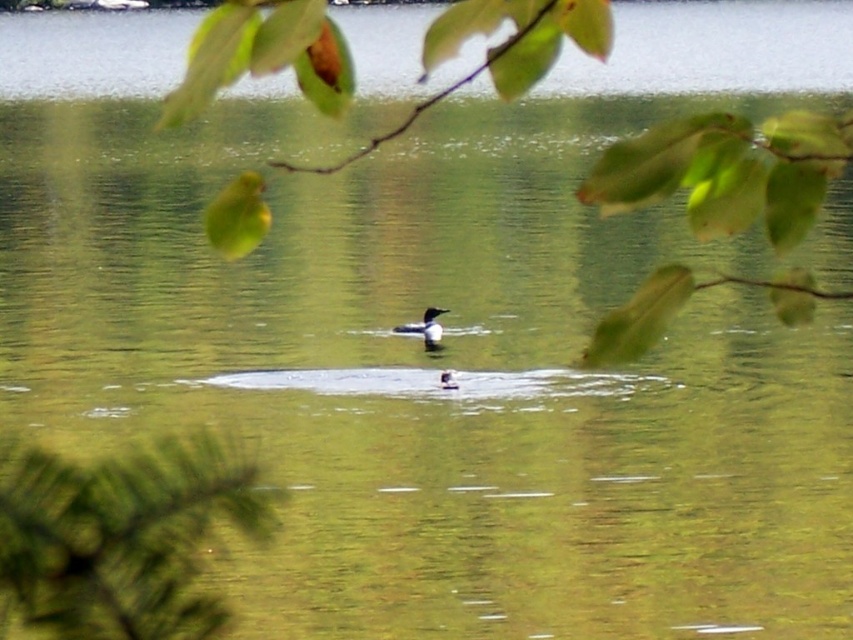
Does green fuzzy branch at lower left appear on the left side of dark brown duck at center?

Correct, you'll find green fuzzy branch at lower left to the left of dark brown duck at center.

Is green fuzzy branch at lower left positioned at the back of dark brown duck at center?

No, it is not.

Find the location of `green fuzzy branch at lower left`. green fuzzy branch at lower left is located at coordinates (120, 538).

Does green leafy branch at upper center have a smaller size compared to green fuzzy branch at lower left?

Incorrect, green leafy branch at upper center is not smaller in size than green fuzzy branch at lower left.

Does green leafy branch at upper center have a greater height compared to green fuzzy branch at lower left?

Yes, green leafy branch at upper center is taller than green fuzzy branch at lower left.

Locate an element on the screen. The image size is (853, 640). green leafy branch at upper center is located at coordinates (728, 170).

Find the location of a particular element. The image size is (853, 640). green leafy branch at upper center is located at coordinates (728, 170).

Is green leafy branch at upper center bigger than dark brown duck at center?

Yes, green leafy branch at upper center is bigger than dark brown duck at center.

What are the coordinates of `green leafy branch at upper center` in the screenshot? It's located at (728, 170).

Is point (694, 193) closer to camera compared to point (432, 321)?

Yes, point (694, 193) is in front of point (432, 321).

Locate an element on the screen. The image size is (853, 640). green leafy branch at upper center is located at coordinates (728, 170).